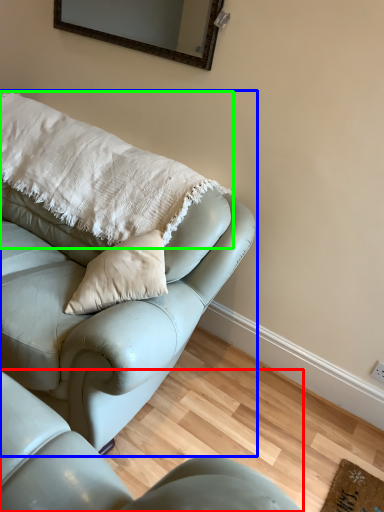
Question: Estimate the real-world distances between objects in this image. Which object is closer to studio couch (highlighted by a red box), studio couch (highlighted by a blue box) or pillow (highlighted by a green box)?

Choices:
 (A) studio couch
 (B) pillow

Answer: (A)